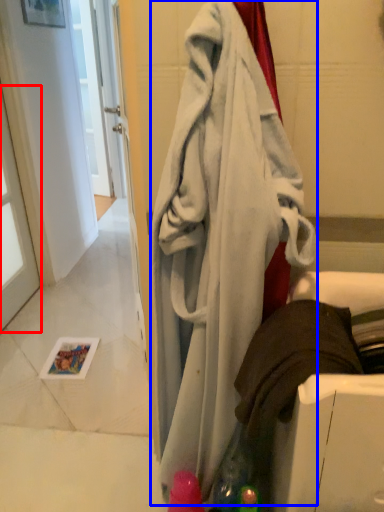
Question: Which of the following is the farthest to the observer, window (highlighted by a red box) or towel (highlighted by a blue box)?

Choices:
 (A) window
 (B) towel

Answer: (A)